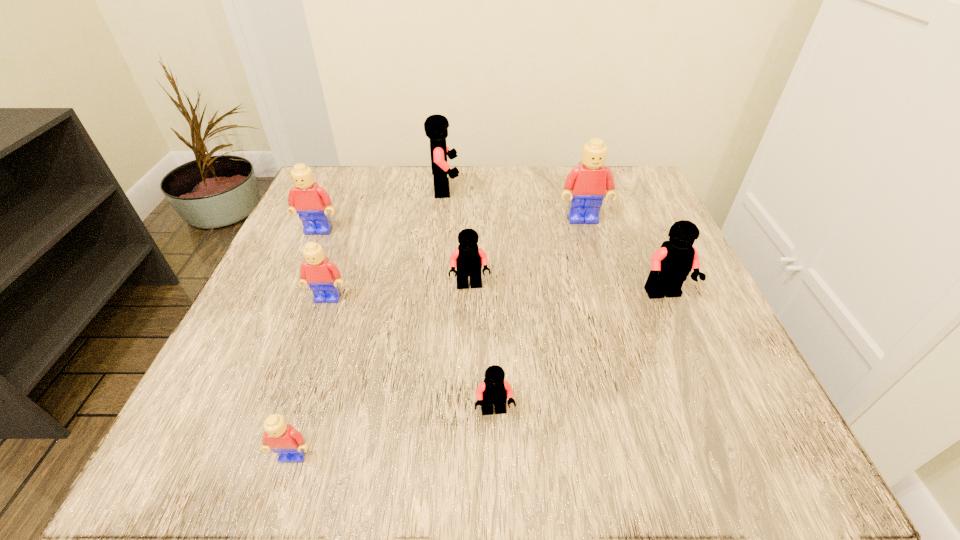
Identify which black Lego is located as the nearest to the third smallest yellow Lego. Please provide its 2D coordinates. Your answer should be formatted as a tuple, i.e. [(x, y)], where the tuple contains the x and y coordinates of a point satisfying the conditions above.

[(436, 126)]

Where is `black Lego that is the third closest to the biggest yellow Lego`? Image resolution: width=960 pixels, height=540 pixels. black Lego that is the third closest to the biggest yellow Lego is located at coordinates (468, 259).

Locate an element on the screen. Image resolution: width=960 pixels, height=540 pixels. yellow Lego that is the fourth nearest to the third biggest black Lego is located at coordinates (281, 438).

Locate which yellow Lego is the third closest to the third biggest black Lego. Please provide its 2D coordinates. Your answer should be formatted as a tuple, i.e. [(x, y)], where the tuple contains the x and y coordinates of a point satisfying the conditions above.

[(309, 200)]

Identify the location of vacant space that satisfies the following two spatial constraints: 1. on the front-facing side of the biggest black Lego; 2. on the front-facing side of the third smallest yellow Lego. The image size is (960, 540). (441, 231).

Find the location of a particular element. The height and width of the screenshot is (540, 960). free space in the image that satisfies the following two spatial constraints: 1. on the front-facing side of the biggest black Lego; 2. on the front-facing side of the third smallest yellow Lego is located at coordinates (441, 231).